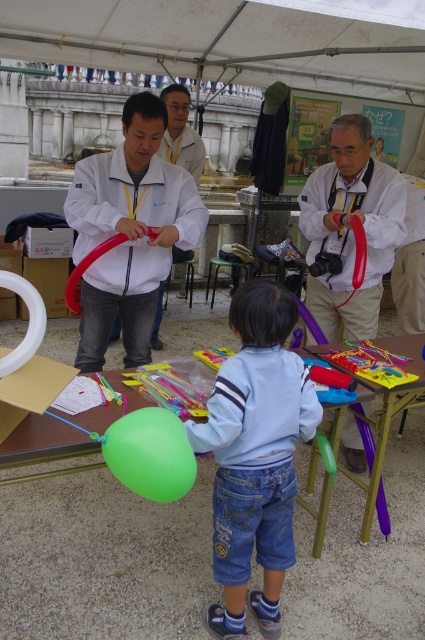
In the scene shown: Between light blue denim pants at center and matte white coat at center, which one is positioned lower?

light blue denim pants at center is lower down.

Locate an element on the screen. The height and width of the screenshot is (640, 425). light blue denim pants at center is located at coordinates (255, 456).

Who is more distant from viewer, (280,404) or (195,157)?

The point (195,157) is more distant.

In order to click on light blue denim pants at center in this screenshot , I will do `click(255, 456)`.

Does light blue denim pants at center have a greater height compared to matte white balloon at center?

Yes, light blue denim pants at center is taller than matte white balloon at center.

Which of these two, light blue denim pants at center or matte white balloon at center, stands taller?

Standing taller between the two is light blue denim pants at center.

Between point (232, 582) and point (328, 225), which one is positioned in front?

Point (232, 582) is in front.

The height and width of the screenshot is (640, 425). What are the coordinates of `light blue denim pants at center` in the screenshot? It's located at (255, 456).

Can you confirm if light blue denim pants at center is bigger than matte white jacket at center?

Actually, light blue denim pants at center might be smaller than matte white jacket at center.

Can you confirm if light blue denim pants at center is positioned to the left of matte white jacket at center?

In fact, light blue denim pants at center is to the right of matte white jacket at center.

Who is more forward, (240, 444) or (133, 134)?

Positioned in front is point (240, 444).

Image resolution: width=425 pixels, height=640 pixels. I want to click on light blue denim pants at center, so click(x=255, y=456).